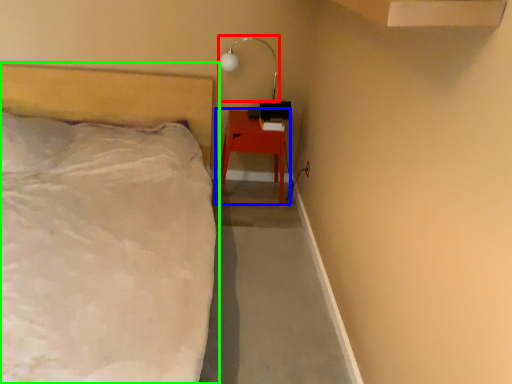
Question: Based on their relative distances, which object is farther from lamp (highlighted by a red box)? Choose from nightstand (highlighted by a blue box) and bed (highlighted by a green box).

Choices:
 (A) nightstand
 (B) bed

Answer: (B)